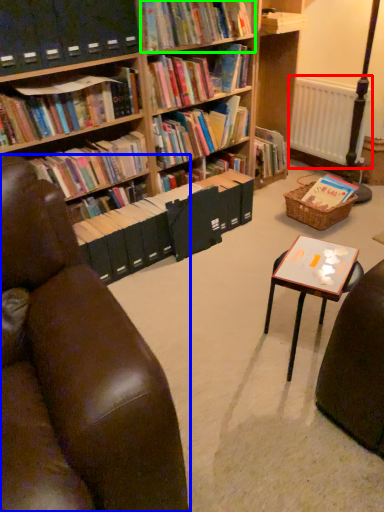
Question: Which is nearer to the radiator (highlighted by a red box)? chair (highlighted by a blue box) or book (highlighted by a green box).

Choices:
 (A) chair
 (B) book

Answer: (B)